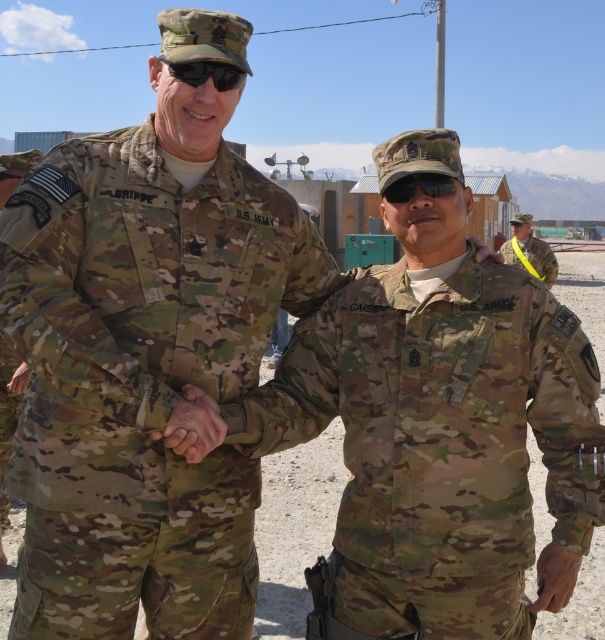
You are a drone operator observing the scene. There is a multicam uniform at center represented by point [142,378]. What is the coordinate of the multicam uniform at center?

The coordinate of the multicam uniform at center is point [142,378].

You are a photographer trying to capture a clear shot of the black matte sunglasses at center and the camouflage uniform at right. Since you want the sunglasses to be the main focus, which object should you position closer to the camera to ensure it appears larger in the photo?

The black matte sunglasses at center should be positioned closer to the camera because even though the camouflage uniform at right is taller, moving the sunglasses closer will make them appear larger in the photo.